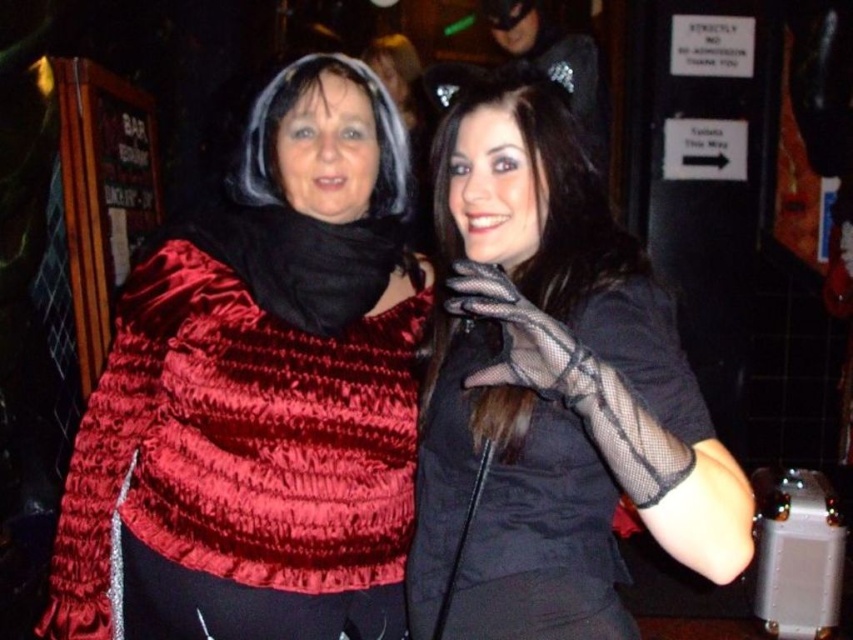
You are a photographer adjusting the lighting in the scene. The velvet red cape at upper left is positioned at coordinates 0.620 on the x and 0.305 on the y. To ensure the cape is well lit, where should you place the spotlight relative to the cape?

The velvet red cape at upper left is located at point (x=259, y=396). To ensure proper lighting, the spotlight should be placed directly above or slightly in front of this coordinate to illuminate the cape effectively without casting harsh shadows.

You are at a party and want to hand a small gift to the person on the right. You are currently standing at the point with coordinates point [71,474]. The person on the right is 1.42 meters away from you. Can you reach them without moving?

The distance between you and the person on the right is 1.42 meters. Since the average human arm length is about 0.7 meters, you cannot reach them without moving closer.

You are at a costume party and need to adjust your accessories. You see the velvet red cape at upper left and the black mesh gloves at center. Which accessory is positioned more to the left side of the image?

The velvet red cape at upper left is positioned more to the left side of the image than the black mesh gloves at center.